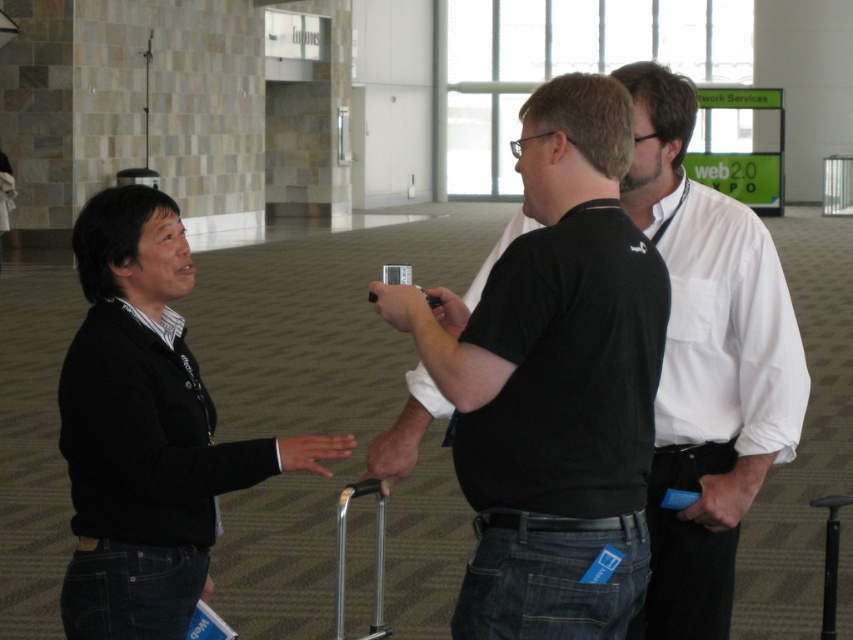
Question: Can you confirm if black matte shirt at center is thinner than black sweater at left?

Choices:
 (A) yes
 (B) no

Answer: (A)

Question: Is black matte shirt at center above black sweater at left?

Choices:
 (A) yes
 (B) no

Answer: (A)

Question: Which object is closer to the camera taking this photo?

Choices:
 (A) black sweater at left
 (B) black matte shirt at center

Answer: (A)

Question: Is black matte shirt at center below black sweater at left?

Choices:
 (A) yes
 (B) no

Answer: (B)